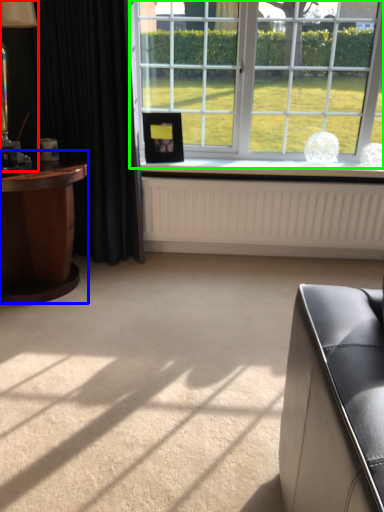
Question: Which object is the farthest from table lamp (highlighted by a red box)? Choose among these: table (highlighted by a blue box) or window (highlighted by a green box).

Choices:
 (A) table
 (B) window

Answer: (B)